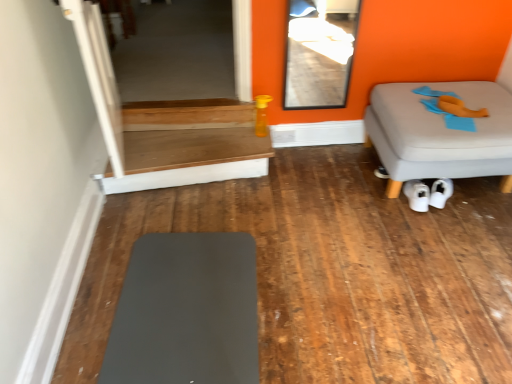
This screenshot has width=512, height=384. Identify the location of empty space that is to the right of matte gray mat at lower left, marked as the second furniture in a right-to-left arrangement. (326, 294).